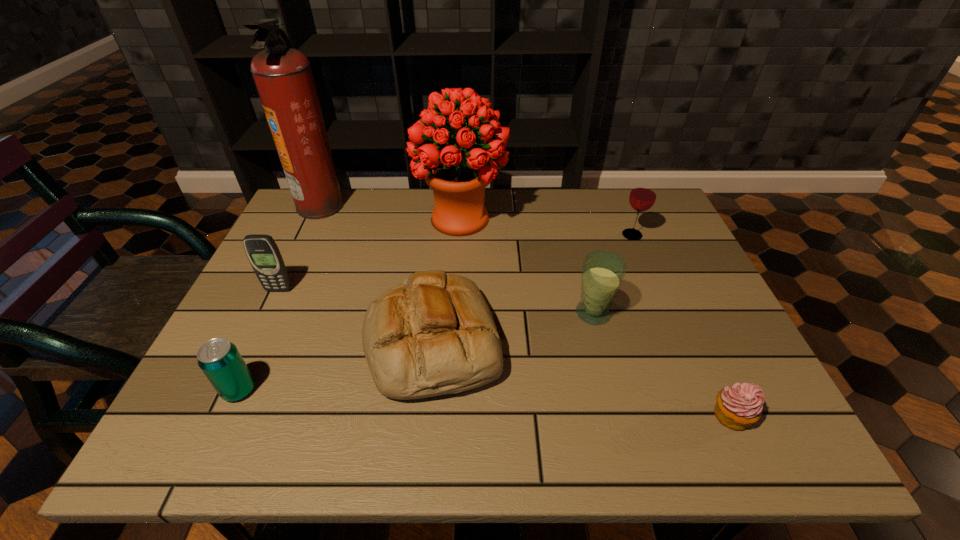
Where is `vacant region that satisfies the following two spatial constraints: 1. on the back side of the right glass; 2. at the nozzle of the fire extinguisher`? This screenshot has width=960, height=540. vacant region that satisfies the following two spatial constraints: 1. on the back side of the right glass; 2. at the nozzle of the fire extinguisher is located at coordinates (619, 205).